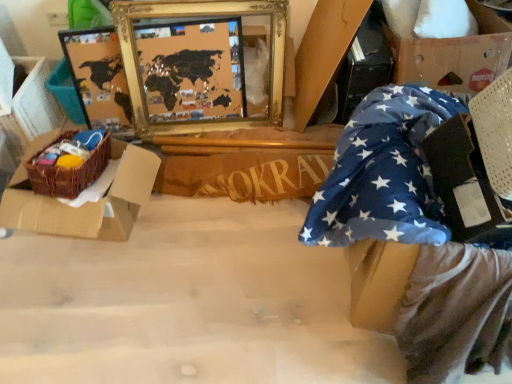
Identify the location of vacant area on top of wooden sign at center (from a real-world perspective). (245, 160).